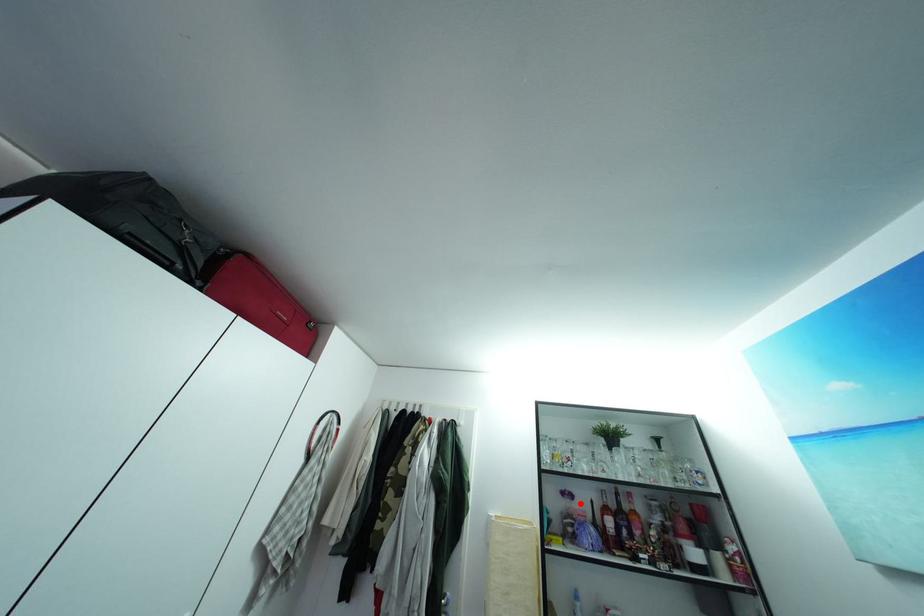
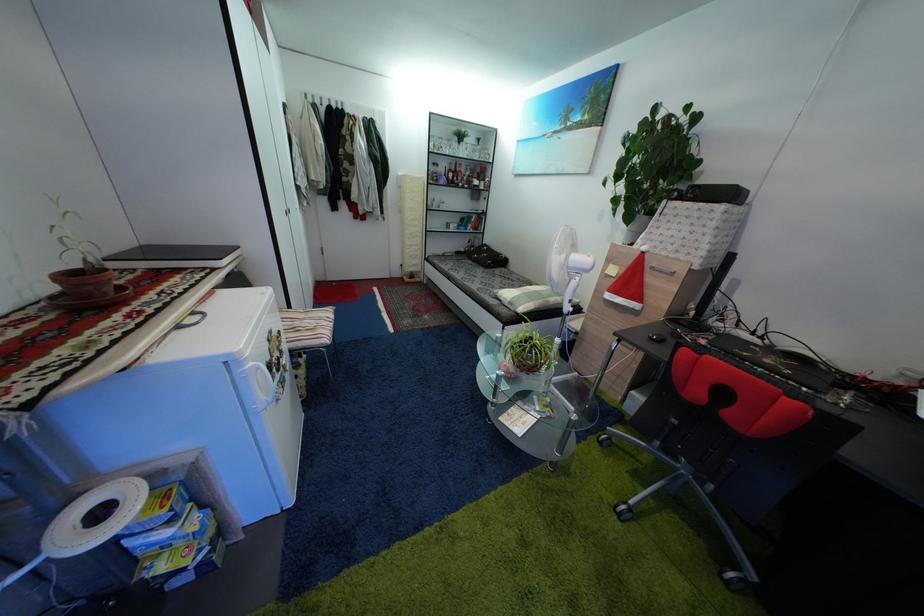
Where in the second image is the point corresponding to the highlighted location from the first image?

(445, 172)